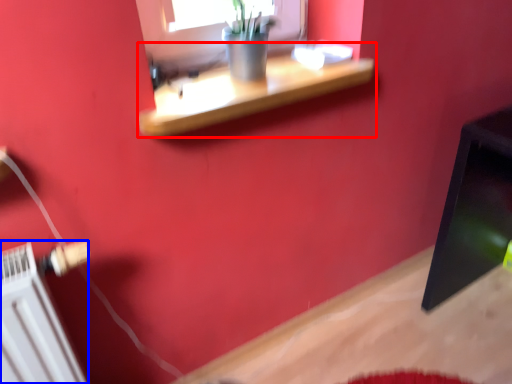
Question: Among these objects, which one is farthest to the camera, shelf (highlighted by a red box) or radiator (highlighted by a blue box)?

Choices:
 (A) shelf
 (B) radiator

Answer: (A)